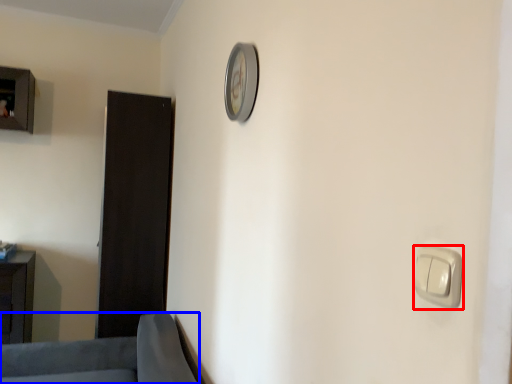
Question: Which object appears closest to the camera in this image, light switch (highlighted by a red box) or furniture (highlighted by a blue box)?

Choices:
 (A) light switch
 (B) furniture

Answer: (A)